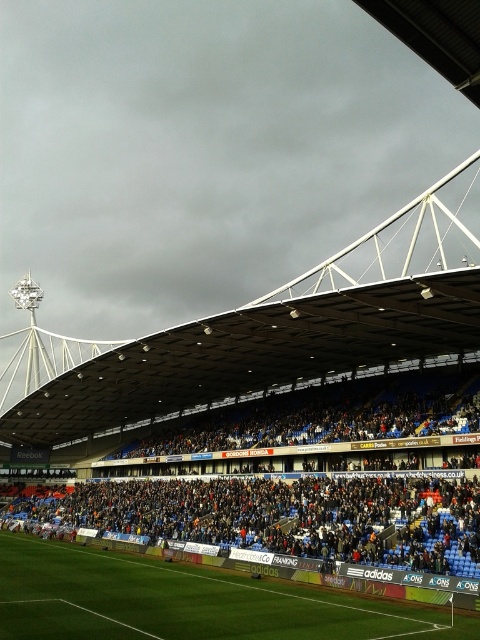
Question: Among these objects, which one is farthest from the camera?

Choices:
 (A) green grass football field at lower left
 (B) dark blue seats at lower center

Answer: (B)

Question: Which point is closer to the camera?

Choices:
 (A) (78, 547)
 (B) (184, 508)

Answer: (B)

Question: Does dark blue seats at lower center appear on the left side of green grass football field at lower left?

Choices:
 (A) yes
 (B) no

Answer: (B)

Question: Is dark blue seats at lower center bigger than green grass football field at lower left?

Choices:
 (A) no
 (B) yes

Answer: (B)

Question: Does dark blue seats at lower center appear over green grass football field at lower left?

Choices:
 (A) yes
 (B) no

Answer: (A)

Question: Which point is closer to the camera taking this photo?

Choices:
 (A) (407, 628)
 (B) (467, 451)

Answer: (A)